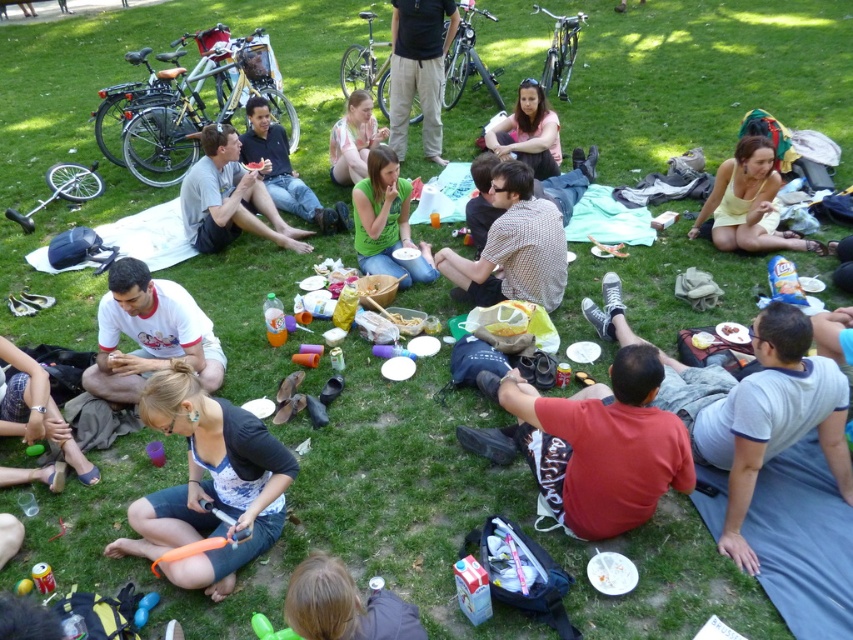
Question: Which of the following is the closest to the observer?

Choices:
 (A) checkered fabric shirt at center
 (B) matte gray shirt at center
 (C) blonde hair at lower center
 (D) green rubber dumbbell at lower left

Answer: (C)

Question: Is white cotton shirt at center above yellow cotton dress at lower right?

Choices:
 (A) yes
 (B) no

Answer: (B)

Question: From the image, what is the correct spatial relationship of red cotton shirt at lower right in relation to matte gray shirt at center?

Choices:
 (A) right
 (B) left

Answer: (A)

Question: Considering the relative positions of gray cotton shirt at lower right and red cotton shirt at lower right in the image provided, where is gray cotton shirt at lower right located with respect to red cotton shirt at lower right?

Choices:
 (A) above
 (B) below

Answer: (A)

Question: Which point appears closest to the camera in this image?

Choices:
 (A) (265, 157)
 (B) (416, 83)

Answer: (A)

Question: Which object is positioned farthest from the matte black shirt at center?

Choices:
 (A) matte gray shirt at center
 (B) yellow cotton dress at lower right
 (C) light pink fabric at center

Answer: (B)